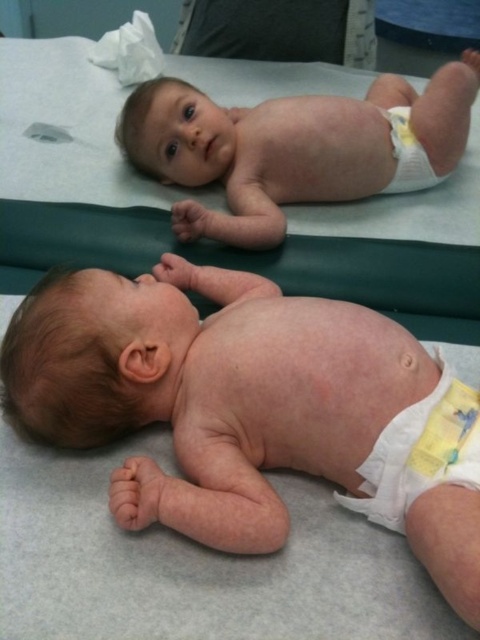
Question: Is gray smooth hospital bed at center below yellow fabric diaper at lower right?

Choices:
 (A) yes
 (B) no

Answer: (B)

Question: Does gray smooth hospital bed at center appear under smooth skin baby at upper center?

Choices:
 (A) no
 (B) yes

Answer: (A)

Question: Which object is positioned farthest from the yellow/white cloth diaper at lower right?

Choices:
 (A) smooth skin baby at upper center
 (B) gray smooth hospital bed at center
 (C) yellow fabric diaper at lower right

Answer: (C)

Question: Among these points, which one is farthest from the camera?

Choices:
 (A) (424, 224)
 (B) (420, 145)
 (C) (177, 202)
 (D) (404, 506)

Answer: (B)

Question: Does pink smooth skin at center lie in front of yellow/white cloth diaper at lower right?

Choices:
 (A) yes
 (B) no

Answer: (A)

Question: Which object appears farthest from the camera in this image?

Choices:
 (A) smooth skin baby at upper center
 (B) yellow/white cloth diaper at lower right

Answer: (A)